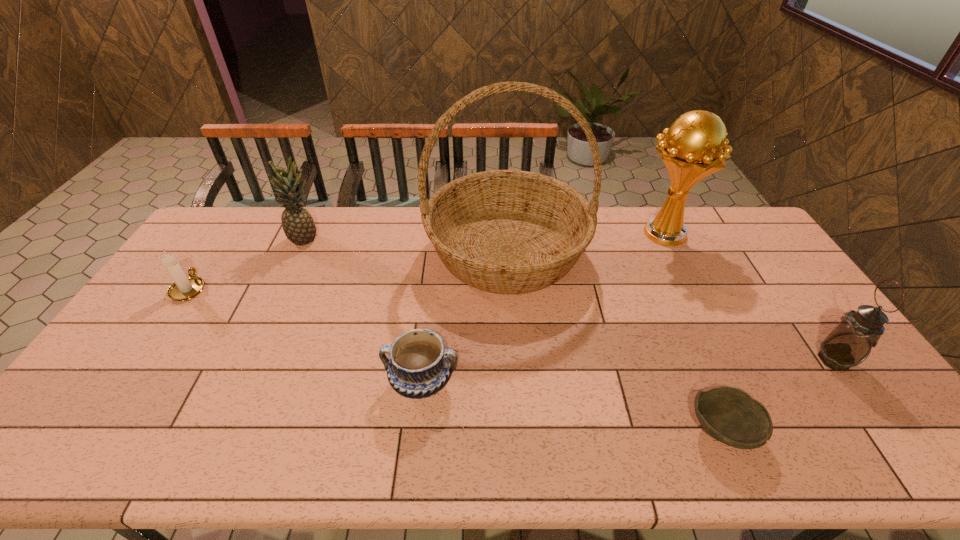
Where is `vacant space that satisfies the following two spatial constraints: 1. on the front side of the tallest object; 2. on the right side of the bowl`? Image resolution: width=960 pixels, height=540 pixels. vacant space that satisfies the following two spatial constraints: 1. on the front side of the tallest object; 2. on the right side of the bowl is located at coordinates (519, 430).

In order to click on free space that satisfies the following two spatial constraints: 1. on the front side of the basket; 2. on the left side of the oil lamp in this screenshot , I will do `click(515, 360)`.

You are a GUI agent. You are given a task and a screenshot of the screen. Output one action in this format:
    pyautogui.click(x=<x>, y=<y>)
    Task: Click on the free location that satisfies the following two spatial constraints: 1. on the back side of the basket; 2. on the right side of the sixth tallest object
    This screenshot has width=960, height=540.
    Given the screenshot: What is the action you would take?
    pyautogui.click(x=437, y=251)

Locate an element on the screen. The image size is (960, 540). blank area in the image that satisfies the following two spatial constraints: 1. at the front of the second tallest object where the globe is prominent; 2. on the front side of the bowl is located at coordinates (760, 430).

Locate an element on the screen. This screenshot has height=540, width=960. vacant point that satisfies the following two spatial constraints: 1. on the handle side of the leftmost object; 2. on the right side of the tallest object is located at coordinates (214, 251).

Locate an element on the screen. free spot that satisfies the following two spatial constraints: 1. at the front of the second tallest object where the globe is prominent; 2. on the front side of the second object from left to right is located at coordinates (665, 239).